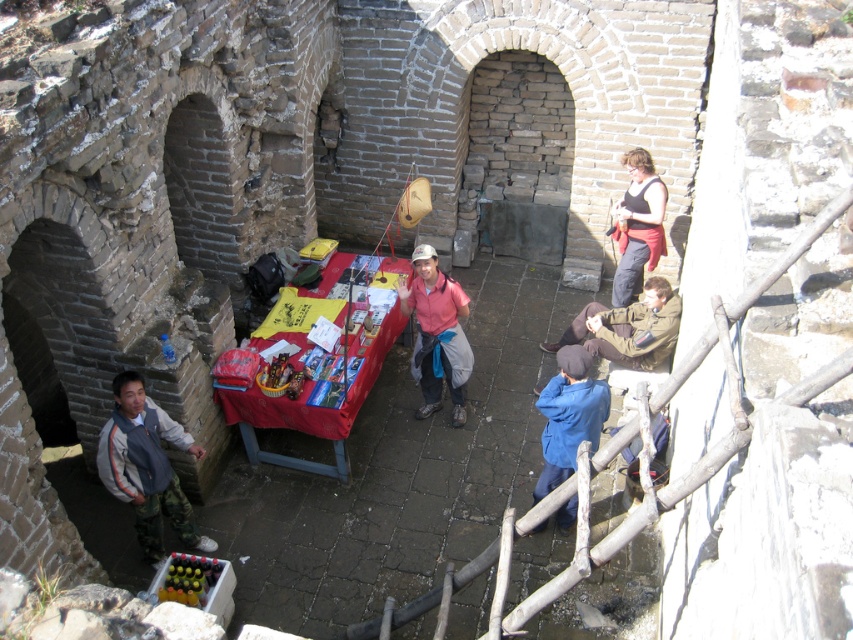
Is matte pink shirt at center to the left of translucent plastic bottles at lower left from the viewer's perspective?

In fact, matte pink shirt at center is to the right of translucent plastic bottles at lower left.

Which is below, matte pink shirt at center or translucent plastic bottles at lower left?

translucent plastic bottles at lower left is lower down.

Who is more forward, (x=434, y=364) or (x=196, y=560)?

Positioned in front is point (x=196, y=560).

Locate an element on the screen. matte pink shirt at center is located at coordinates (437, 333).

Is matte pink shirt at center above camouflage pants at lower right?

Yes.

Which is in front, point (434, 349) or point (642, 305)?

Positioned in front is point (434, 349).

Describe the element at coordinates (437, 333) in the screenshot. I see `matte pink shirt at center` at that location.

At what (x,y) coordinates should I click in order to perform the action: click on matte pink shirt at center. Please return your answer as a coordinate pair (x, y). Looking at the image, I should click on (437, 333).

Is camouflage pants at lower left positioned behind matte pink shirt at center?

No, camouflage pants at lower left is in front of matte pink shirt at center.

Image resolution: width=853 pixels, height=640 pixels. I want to click on camouflage pants at lower left, so click(148, 467).